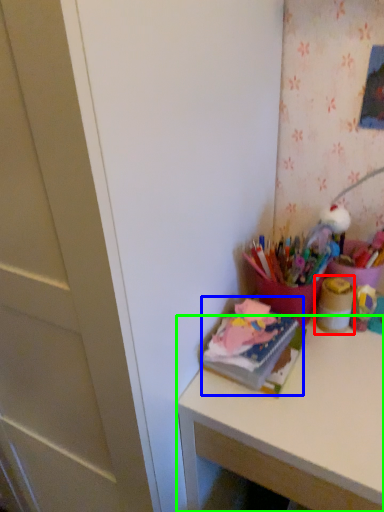
Question: Considering the real-world distances, which object is closest to stationery (highlighted by a red box)? book (highlighted by a blue box) or desk (highlighted by a green box).

Choices:
 (A) book
 (B) desk

Answer: (A)